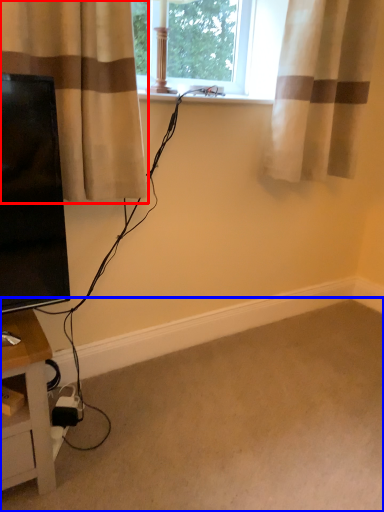
Question: Which object is further to the camera taking this photo, curtain (highlighted by a red box) or plain (highlighted by a blue box)?

Choices:
 (A) curtain
 (B) plain

Answer: (A)